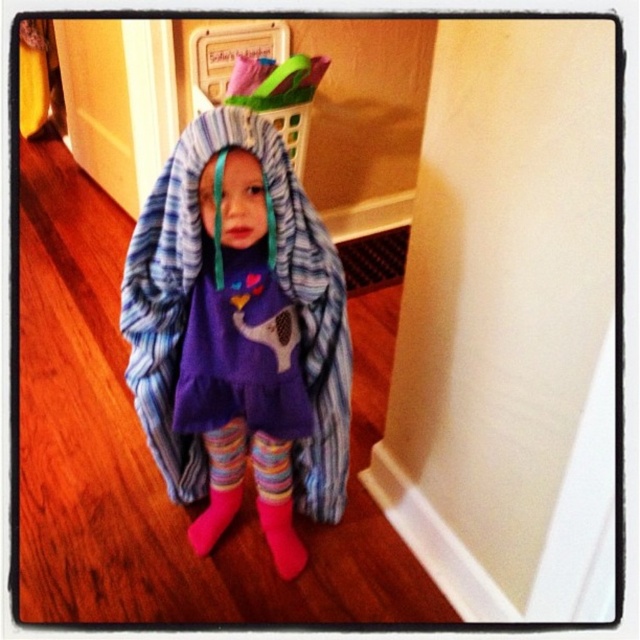
You are a delivery robot in a house. You need to deliver a package to the point at (282, 572). You are currently at the point at (228, 115). According to the image, which direction should you move to reach the destination?

Point (228, 115) is in front of point (282, 572). So to reach the destination, you should move backward from point (228, 115).

You are a robot trying to navigate to a specific location in the room. You are currently at point (234, 500). The target location is point (220, 150). Can you move directly towards the target without any obstacles in between?

Yes, because point (220, 150) is in front of point (234, 500), meaning there is a clear path between them.

You are a parent trying to tidy up the laundry. You see the striped fleece blanket at center and the pink fuzzy sock at lower center. How far apart are these two items in centimeters?

The striped fleece blanket at center is 35.61 centimeters away from the pink fuzzy sock at lower center.